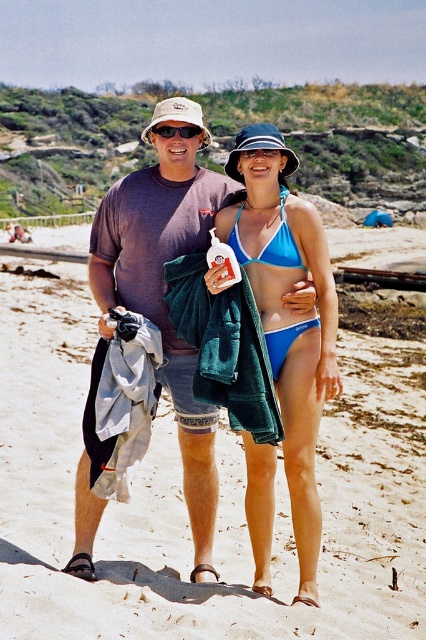
You are a photographer trying to capture the perfect shot of the two people on the beach. You notice a point at coordinates (302,376). What object is located at this point?

The point at coordinates (302,376) corresponds to the matte blue bikini at center.

You are a photographer at the beach and need to ensure both the matte blue bikini at center and the blue fabric bikini top at center are visible in the frame. Which one should you focus on to capture both without zooming in or out?

The matte blue bikini at center is smaller than the blue fabric bikini top at center, so focusing on the larger blue fabric bikini top at center will help ensure both are visible in the frame without needing to adjust the zoom.

You are a photographer setting up for a beach photoshoot. You need to position two models wearing the blue matte bikini at center and the blue fabric bikini top at center so that both are visible in the frame. Which model should stand closer to the camera to ensure both are fully visible?

The blue fabric bikini top at center should stand closer to the camera because it is shorter than the blue matte bikini at center, ensuring both will be fully visible in the frame.